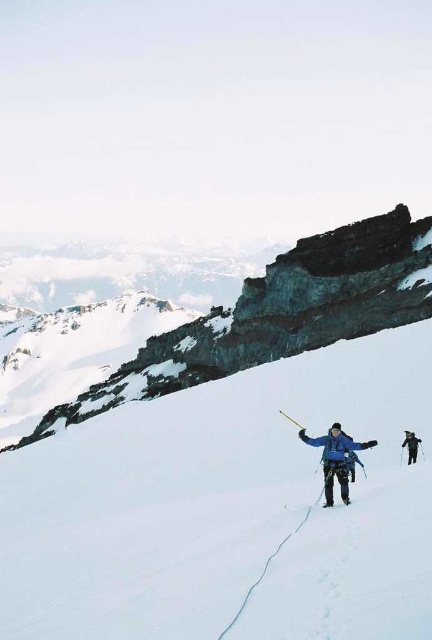
Measure the distance from blue fabric jacket at center to shiny metallic ski at center.

blue fabric jacket at center is 9.09 feet away from shiny metallic ski at center.

The width and height of the screenshot is (432, 640). Identify the location of blue fabric jacket at center. (334, 456).

Where is `blue fabric jacket at center`? blue fabric jacket at center is located at coordinates (334, 456).

Identify the location of white snow ski slope at center. (228, 508).

Identify the location of white snow ski slope at center. (228, 508).

From the picture: Who is shorter, blue fabric jacket at center or dark blue jacket at center?

dark blue jacket at center is shorter.

Where is `blue fabric jacket at center`? blue fabric jacket at center is located at coordinates (334, 456).